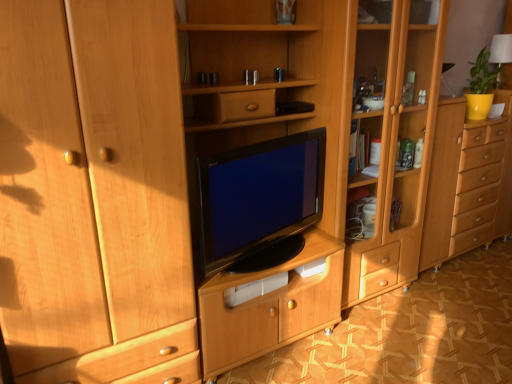
Describe the element at coordinates (258, 198) in the screenshot. I see `matte black tv at center` at that location.

Locate an element on the screen. matte black tv at center is located at coordinates (258, 198).

Measure the distance between matte black tv at center and camera.

The depth of matte black tv at center is 5.50 feet.

At what (x,y) coordinates should I click in order to perform the action: click on matte black tv at center. Please return your answer as a coordinate pair (x, y). Looking at the image, I should click on (258, 198).